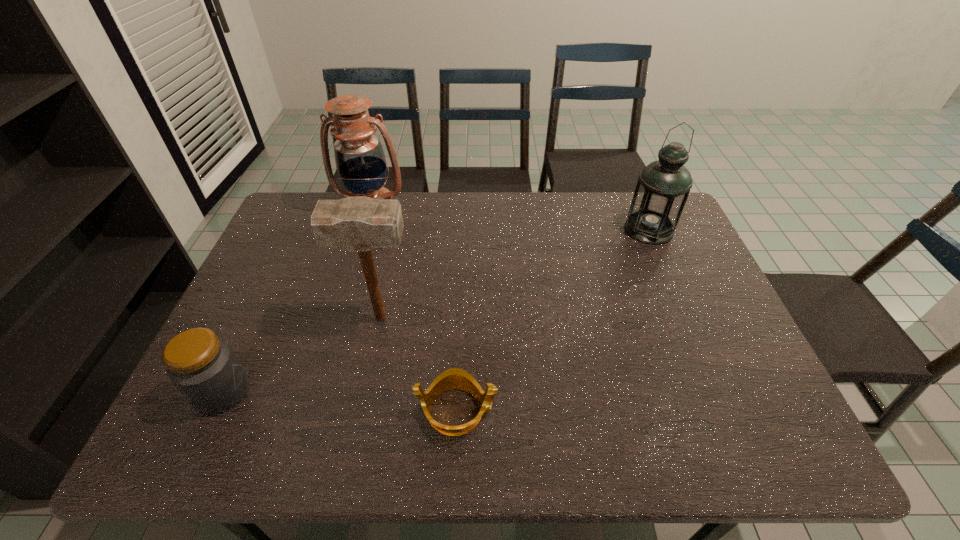
This screenshot has width=960, height=540. I want to click on vacant space at the far left corner of the desktop, so click(x=278, y=233).

In the image, there is a desktop. Find the location of `free space at the far right corner`. free space at the far right corner is located at coordinates (621, 192).

This screenshot has width=960, height=540. I want to click on free space between the left oil lamp and the right oil lamp, so click(510, 220).

Locate an element on the screen. free space between the fourth object from left to right and the mallet is located at coordinates (419, 364).

Find the location of a particular element. This screenshot has height=540, width=960. unoccupied area between the third nearest object and the shortest object is located at coordinates (419, 364).

In order to click on free space that is in between the third nearest object and the second shortest object in this screenshot , I will do `click(301, 354)`.

At what (x,y) coordinates should I click in order to perform the action: click on free area in between the left oil lamp and the second object from right to left. Please return your answer as a coordinate pair (x, y). This screenshot has height=540, width=960. Looking at the image, I should click on [414, 310].

Locate an element on the screen. vacant area that lies between the left oil lamp and the mallet is located at coordinates (375, 264).

The image size is (960, 540). I want to click on free space between the rightmost object and the second object from right to left, so click(x=553, y=320).

The height and width of the screenshot is (540, 960). Identify the location of vacant area that lies between the rightmost object and the left oil lamp. (510, 220).